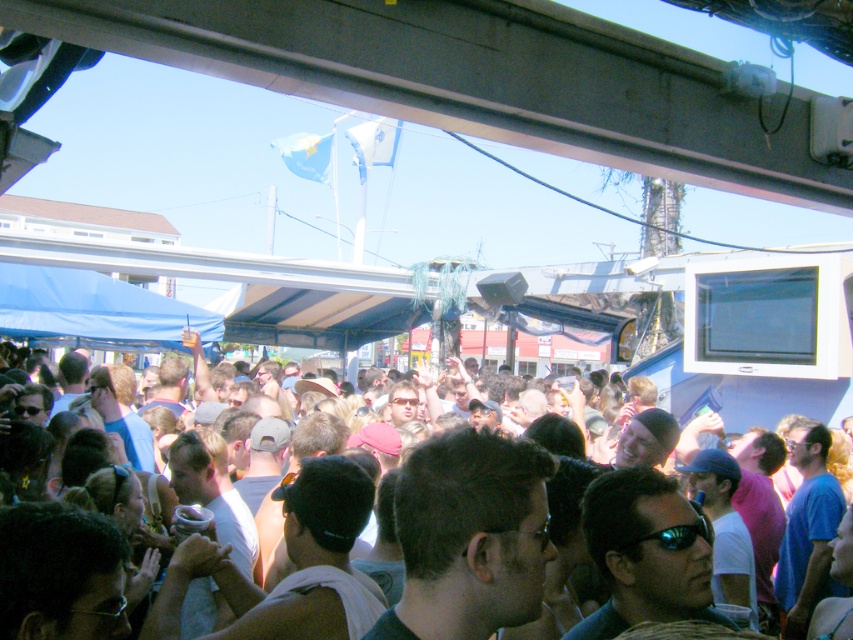
You are a photographer trying to capture a candid shot of the crowd at this festival. You notice a person wearing a white cotton shirt at center and black reflective sunglasses at center. Which object should you focus on first if you want to ensure both are in the same frame without moving the camera?

The white cotton shirt at center is much taller than the black reflective sunglasses at center, so focusing on the white cotton shirt at center first will help ensure both are in the frame since it occupies a larger portion of the image.

You are a photographer at the festival and want to capture both the white cotton shirt at center and the black reflective sunglasses at center in a single shot. Which object should you position closer to the left side of your camera frame?

The white cotton shirt at center should be positioned closer to the left side of your camera frame because it is already located to the left of the black reflective sunglasses at center in the scene.

Looking at this image, you are a photographer standing at the edge of the crowd. You want to take a photo of the white cotton shirt at center and the black reflective sunglasses at center. If your camera can focus on objects within a 4 meter range, will both items be in focus?

The white cotton shirt at center is 3.83 meters from the black reflective sunglasses at center. Since the distance between them is within the 4 meter range, both items will be in focus.